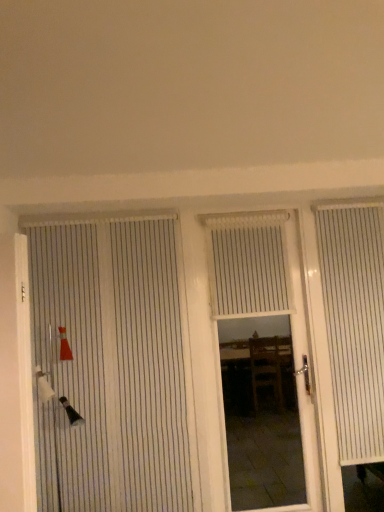
Find the location of a particular element. white wood door at center, arranged as the 2th door when viewed from the left is located at coordinates (264, 332).

The image size is (384, 512). Describe the element at coordinates (248, 264) in the screenshot. I see `white textured blind at center` at that location.

Where is `white striped door at left, the first door when ordered from left to right`? Image resolution: width=384 pixels, height=512 pixels. white striped door at left, the first door when ordered from left to right is located at coordinates (119, 362).

This screenshot has width=384, height=512. In the image, there is a white textured blind at center. Identify the location of curtain below it (from the image's perspective). (354, 324).

What's the angular difference between white textured blind at center and white striped curtain at right's facing directions?

0.456 degrees.

Considering the sizes of objects white textured blind at center and white striped curtain at right in the image provided, who is bigger, white textured blind at center or white striped curtain at right?

Bigger between the two is white striped curtain at right.

From the image's perspective, is white textured blind at center under white striped curtain at right?

Incorrect, from the image's perspective, white textured blind at center is higher than white striped curtain at right.

Is white wood door at center, marked as the first door in a right-to-left arrangement, completely or partially inside white textured blind at center?

Yes, white textured blind at center contains white wood door at center, marked as the first door in a right-to-left arrangement.

Find the location of a particular element. This screenshot has height=512, width=384. blind that appears above the white wood door at center, arranged as the 2th door when viewed from the left (from a real-world perspective) is located at coordinates (248, 264).

Between white textured blind at center and white wood door at center, arranged as the 2th door when viewed from the left, which one appears on the right side from the viewer's perspective?

From the viewer's perspective, white wood door at center, arranged as the 2th door when viewed from the left, appears more on the right side.

From a real-world perspective, which is physically below, white striped curtain at right or white textured blind at center?

From a 3D spatial view, white striped curtain at right is below.

Could you tell me if white striped curtain at right is turned towards white textured blind at center?

No, white striped curtain at right is not turned towards white textured blind at center.

Considering the sizes of objects white striped curtain at right and white textured blind at center in the image provided, who is thinner, white striped curtain at right or white textured blind at center?

With smaller width is white textured blind at center.

Considering the sizes of objects white striped curtain at right and white textured blind at center in the image provided, who is taller, white striped curtain at right or white textured blind at center?

Standing taller between the two is white striped curtain at right.

Is white striped door at left, the first door when ordered from left to right, situated inside white wood door at center, marked as the first door in a right-to-left arrangement, or outside?

white striped door at left, the first door when ordered from left to right, lies outside white wood door at center, marked as the first door in a right-to-left arrangement.

What are the coordinates of `door that appears below the white striped door at left, the 2th door from the right (from the image's perspective)` in the screenshot? It's located at (264, 332).

Could you tell me if white striped door at left, the first door when ordered from left to right, is turned towards white wood door at center, arranged as the 2th door when viewed from the left?

No, white striped door at left, the first door when ordered from left to right, is not aimed at white wood door at center, arranged as the 2th door when viewed from the left.

From a real-world perspective, which object rests below the other?

white wood door at center, arranged as the 2th door when viewed from the left.

Is white textured blind at center at the right side of white striped door at left, the first door when ordered from left to right?

Correct, you'll find white textured blind at center to the right of white striped door at left, the first door when ordered from left to right.

Is white textured blind at center turned away from white striped door at left, the 2th door from the right?

No, white textured blind at center is not facing away from white striped door at left, the 2th door from the right.

From the image's perspective, which one is positioned lower, white textured blind at center or white striped door at left, the 2th door from the right?

white striped door at left, the 2th door from the right, from the image's perspective.

Between point (271, 305) and point (75, 229), which one is positioned behind?

The point (271, 305) is behind.

Which is closer, (316, 449) or (342, 266)?

Point (316, 449) appears to be closer to the viewer than point (342, 266).

Can you confirm if white wood door at center, marked as the first door in a right-to-left arrangement, is smaller than white striped curtain at right?

Incorrect, white wood door at center, marked as the first door in a right-to-left arrangement, is not smaller in size than white striped curtain at right.

Locate an element on the screen. This screenshot has height=512, width=384. the 2nd door positioned below the white striped curtain at right (from the image's perspective) is located at coordinates (264, 332).

Is white wood door at center, arranged as the 2th door when viewed from the left, aimed at white textured blind at center?

Yes, white wood door at center, arranged as the 2th door when viewed from the left, is oriented towards white textured blind at center.

Would you say white wood door at center, marked as the first door in a right-to-left arrangement, is inside or outside white textured blind at center?

white wood door at center, marked as the first door in a right-to-left arrangement, lies outside white textured blind at center.

This screenshot has height=512, width=384. Identify the location of curtain in front of the white textured blind at center. (354, 324).

Image resolution: width=384 pixels, height=512 pixels. Find the location of `door on the right of white textured blind at center`. door on the right of white textured blind at center is located at coordinates (264, 332).

Based on the photo, from the image, which object appears to be farther from white striped door at left, the first door when ordered from left to right, white wood door at center, marked as the first door in a right-to-left arrangement, or white striped curtain at right?

Among the two, white wood door at center, marked as the first door in a right-to-left arrangement, is located further to white striped door at left, the first door when ordered from left to right.

Estimate the real-world distances between objects in this image. Which object is closer to white wood door at center, marked as the first door in a right-to-left arrangement, white striped door at left, the first door when ordered from left to right, or white textured blind at center?

Based on the image, white textured blind at center appears to be nearer to white wood door at center, marked as the first door in a right-to-left arrangement.

Considering their positions, is white wood door at center, arranged as the 2th door when viewed from the left, positioned further to white textured blind at center than white striped door at left, the 2th door from the right?

Among the two, white wood door at center, arranged as the 2th door when viewed from the left, is located further to white textured blind at center.

Based on their spatial positions, is white wood door at center, arranged as the 2th door when viewed from the left, or white textured blind at center further from white striped curtain at right?

white wood door at center, arranged as the 2th door when viewed from the left, lies further to white striped curtain at right than the other object.

Looking at the image, which one is located further to white wood door at center, arranged as the 2th door when viewed from the left, white textured blind at center or white striped curtain at right?

Based on the image, white textured blind at center appears to be further to white wood door at center, arranged as the 2th door when viewed from the left.

Estimate the real-world distances between objects in this image. Which object is further from white textured blind at center, white wood door at center, arranged as the 2th door when viewed from the left, or white striped curtain at right?

white wood door at center, arranged as the 2th door when viewed from the left.

From the image, which object appears to be nearer to white striped curtain at right, white striped door at left, the first door when ordered from left to right, or white textured blind at center?

white textured blind at center.

Which object lies further to the anchor point white wood door at center, arranged as the 2th door when viewed from the left, white striped curtain at right or white striped door at left, the 2th door from the right?

white striped door at left, the 2th door from the right, is further to white wood door at center, arranged as the 2th door when viewed from the left.

This screenshot has height=512, width=384. In order to click on door located between white textured blind at center and white striped curtain at right in the left-right direction in this screenshot , I will do pyautogui.click(x=264, y=332).

You are a GUI agent. You are given a task and a screenshot of the screen. Output one action in this format:
    pyautogui.click(x=<x>, y=<y>)
    Task: Click on the door located between white striped door at left, the first door when ordered from left to right, and white striped curtain at right in the left-right direction
    The image size is (384, 512).
    Given the screenshot: What is the action you would take?
    pyautogui.click(x=264, y=332)

Where is `blind between white striped door at left, the first door when ordered from left to right, and white wood door at center, marked as the first door in a right-to-left arrangement, from left to right`? blind between white striped door at left, the first door when ordered from left to right, and white wood door at center, marked as the first door in a right-to-left arrangement, from left to right is located at coordinates (248, 264).

Identify the location of blind between white striped door at left, the first door when ordered from left to right, and white striped curtain at right, in the horizontal direction. (248, 264).